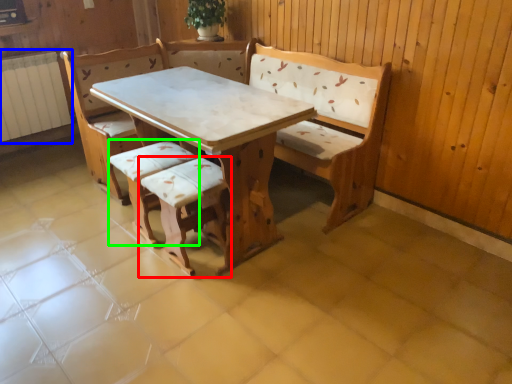
Question: Which object is positioned closest to armchair (highlighted by a red box)? Select from radiator (highlighted by a blue box) and armchair (highlighted by a green box).

Choices:
 (A) radiator
 (B) armchair

Answer: (B)